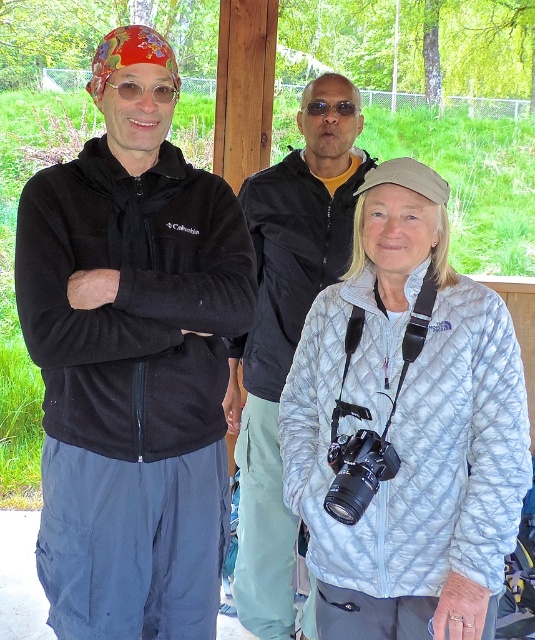
Question: Considering the real-world distances, which object is closest to the matte black jacket at center?

Choices:
 (A) light blue quilted jacket at center
 (B) matte black hoodie at left

Answer: (B)

Question: Considering the relative positions of matte black hoodie at left and black plastic camera at center in the image provided, where is matte black hoodie at left located with respect to black plastic camera at center?

Choices:
 (A) below
 (B) above

Answer: (B)

Question: Which point is farther from the camera taking this photo?

Choices:
 (A) (286, 307)
 (B) (211, 576)
 (C) (365, 476)
 (D) (370, 416)

Answer: (A)

Question: Does light blue quilted jacket at center have a greater width compared to black plastic camera at center?

Choices:
 (A) no
 (B) yes

Answer: (B)

Question: Can you confirm if matte black jacket at center is wider than black plastic camera at center?

Choices:
 (A) yes
 (B) no

Answer: (A)

Question: Which point appears farthest from the camera in this image?

Choices:
 (A) (360, 490)
 (B) (409, 291)
 (C) (315, 93)

Answer: (C)